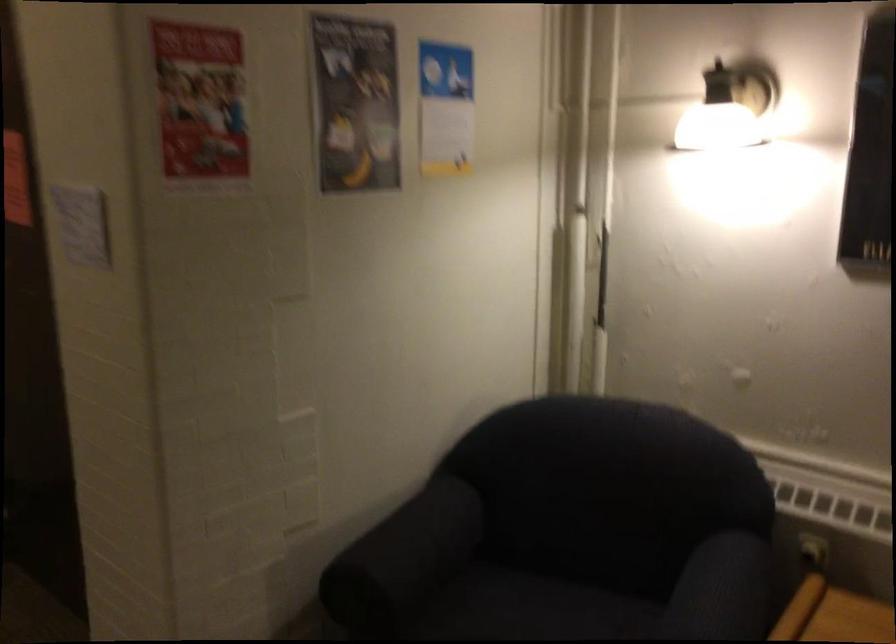
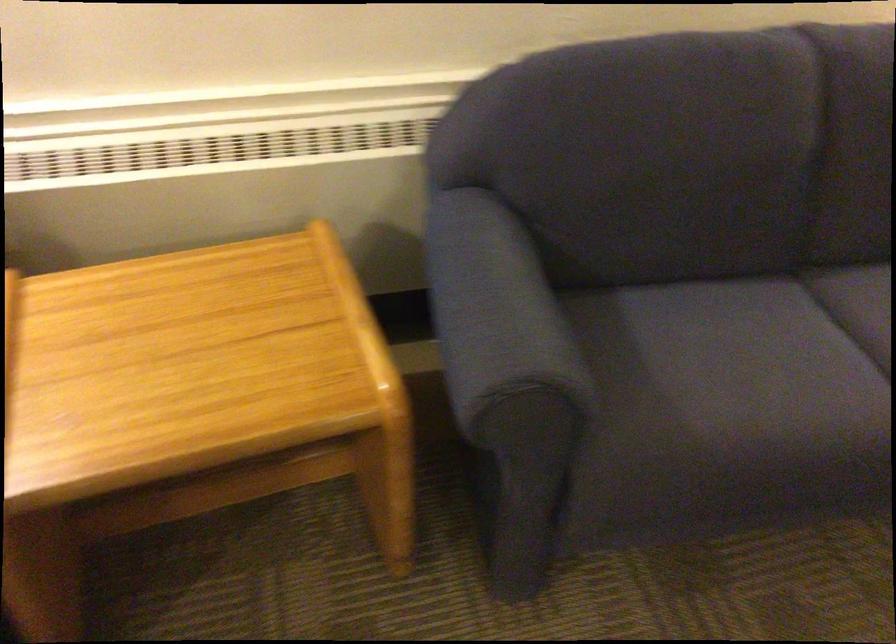
How did the camera likely rotate?

The rotation direction of the camera is right-down.